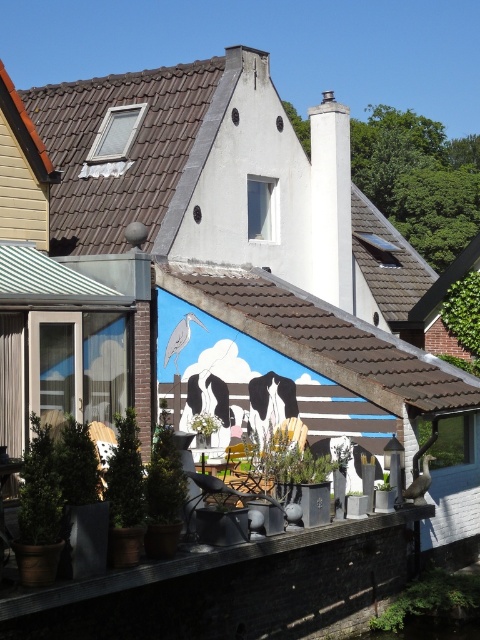
Is point (194, 429) behind point (382, 486)?

Yes, point (194, 429) is behind point (382, 486).

Is point (204, 433) farther from viewer compared to point (380, 483)?

Yes, point (204, 433) is farther from viewer.

Identify the location of green leafy plant at center. (205, 424).

Between green leafy plant at lower right and green leafy plant at center, which one is positioned lower?

green leafy plant at lower right is lower down.

Locate an element on the screen. This screenshot has width=480, height=640. green leafy plant at lower right is located at coordinates (433, 600).

Measure the distance from green leafy plant at lower right to green matte plant at center.

7.54 feet

Can you confirm if green leafy plant at lower right is taller than green matte plant at center?

Yes, green leafy plant at lower right is taller than green matte plant at center.

Where is `green leafy plant at lower right`? The image size is (480, 640). green leafy plant at lower right is located at coordinates (433, 600).